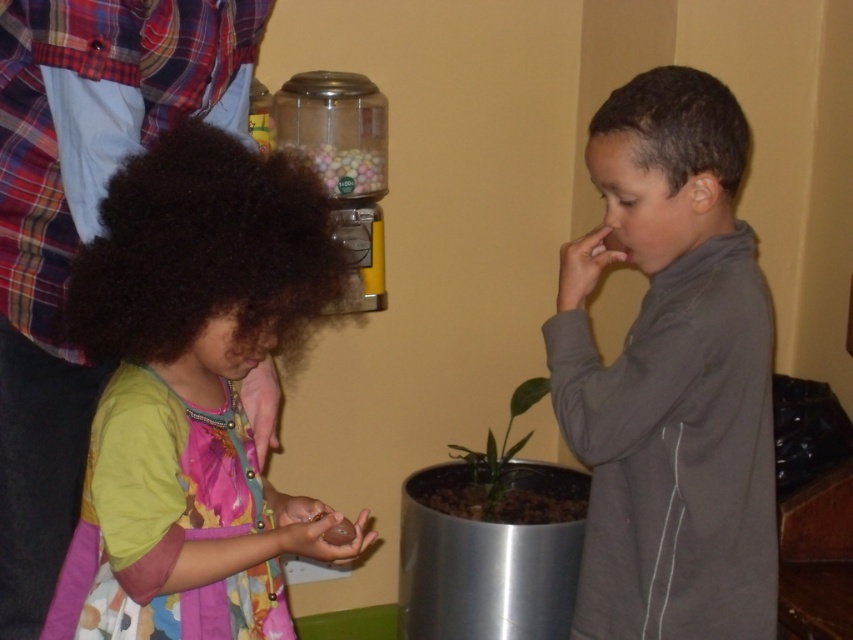
Question: Which of the following is the closest to the observer?

Choices:
 (A) gray matte jacket at right
 (B) translucent plastic jar at upper center
 (C) matte green dress at left

Answer: (C)

Question: Which point appears closest to the camera in this image?

Choices:
 (A) (74, 580)
 (B) (378, 163)

Answer: (A)

Question: Is gray matte jacket at right bigger than green leafy plant at center?

Choices:
 (A) no
 (B) yes

Answer: (B)

Question: Does green leafy plant at center appear under translucent plastic jar at upper center?

Choices:
 (A) no
 (B) yes

Answer: (B)

Question: Where is green leafy plant at center located in relation to chocolate matte at lower left in the image?

Choices:
 (A) below
 (B) above

Answer: (A)

Question: Estimate the real-world distances between objects in this image. Which object is closer to the green leafy plant at center?

Choices:
 (A) gray matte jacket at right
 (B) translucent plastic jar at upper center
 (C) chocolate matte at lower left

Answer: (B)